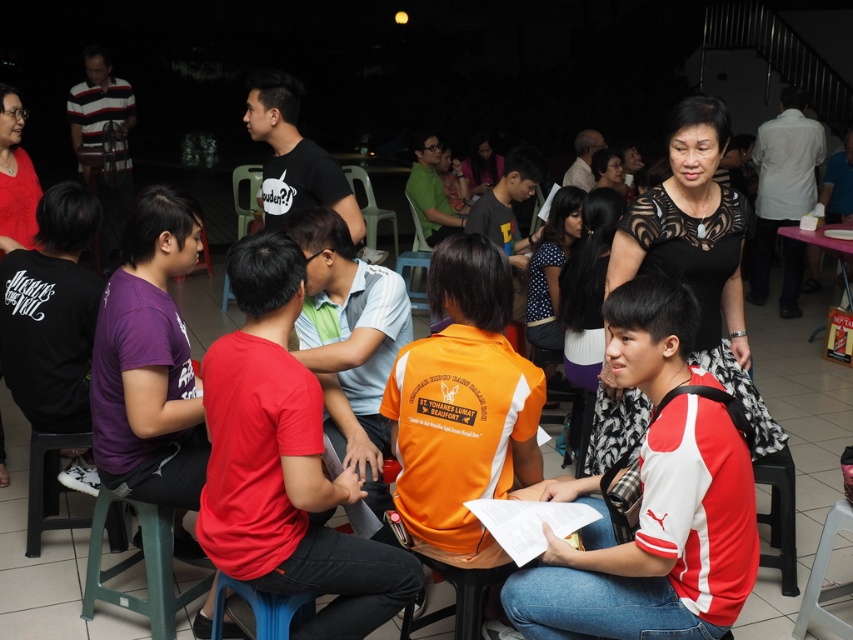
Question: Is black plastic chair at lower left in front of blue plastic chair at lower center?

Choices:
 (A) no
 (B) yes

Answer: (A)

Question: Does green plastic chair at lower left have a lesser width compared to black plastic chair at lower left?

Choices:
 (A) no
 (B) yes

Answer: (A)

Question: Which is farther from the plastic stool at lower right?

Choices:
 (A) red matte shirt at center
 (B) blue plastic chair at lower center
 (C) metallic plastic chair at center
 (D) black plastic chair at lower left

Answer: (C)

Question: Does black plastic chair at lower left have a smaller size compared to white plastic chair at center?

Choices:
 (A) no
 (B) yes

Answer: (B)

Question: Which object is farther from the camera taking this photo?

Choices:
 (A) white plastic chair at center
 (B) red matte shirt at center

Answer: (A)

Question: Estimate the real-world distances between objects in this image. Which object is farther from the red matte shirt at center?

Choices:
 (A) black plastic chair at lower left
 (B) blue plastic chair at lower center
 (C) metallic plastic chair at center
 (D) white plastic chair at center

Answer: (C)